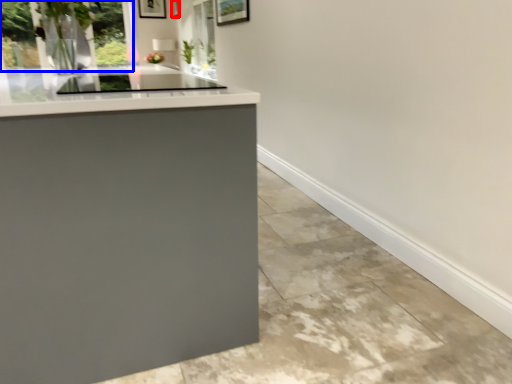
Question: Which point is closer to the camera, picture frame (highlighted by a red box) or window (highlighted by a blue box)?

Choices:
 (A) picture frame
 (B) window

Answer: (B)